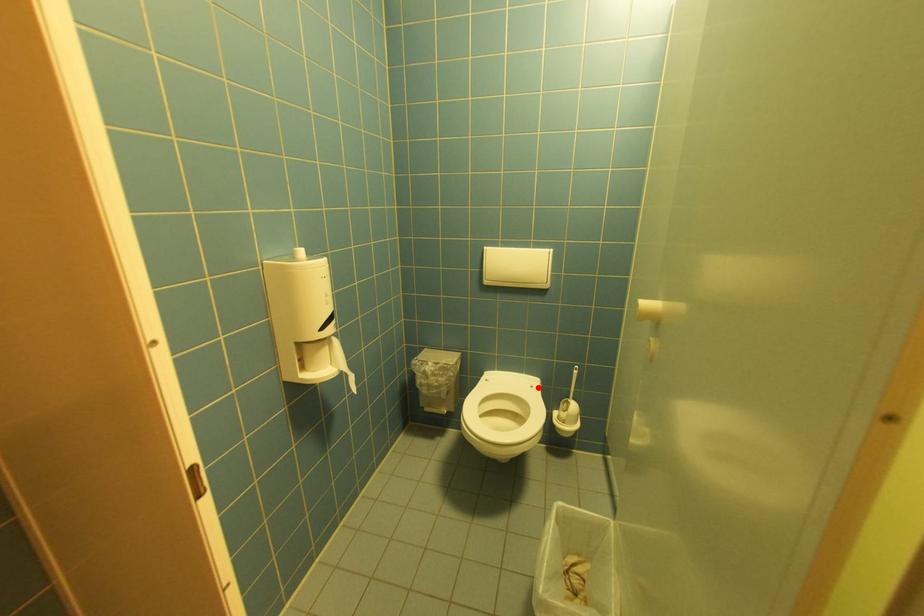
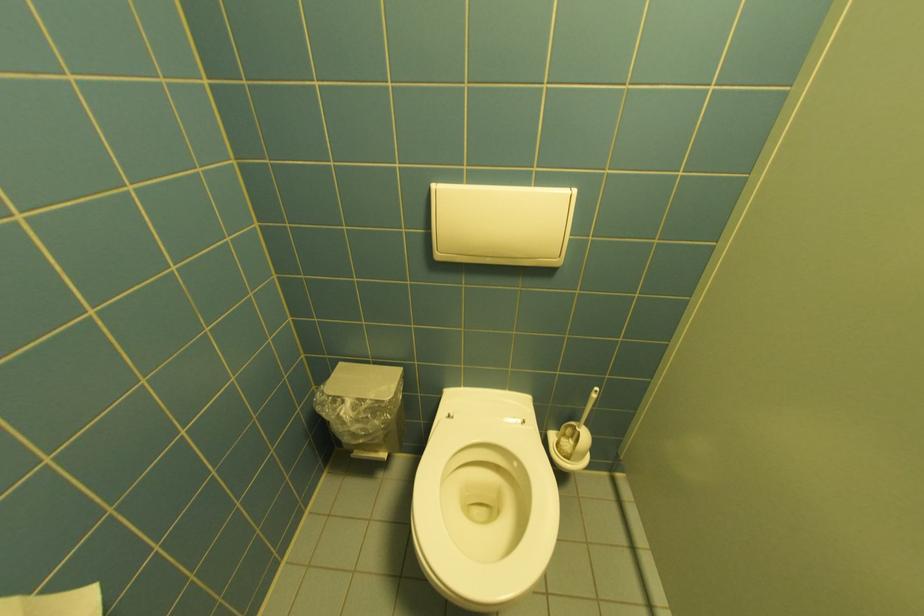
Locate, in the second image, the point that corresponds to the highlighted location in the first image.

(529, 424)